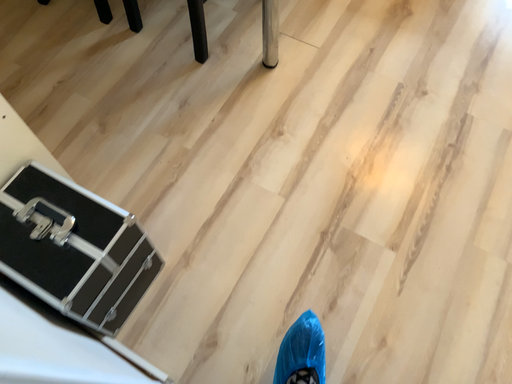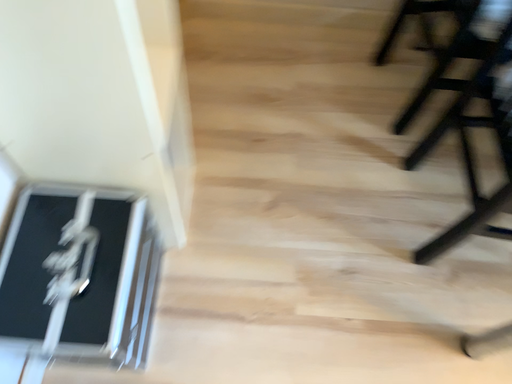
Question: How did the camera likely rotate when shooting the video?

Choices:
 (A) rotated left
 (B) rotated right

Answer: (A)